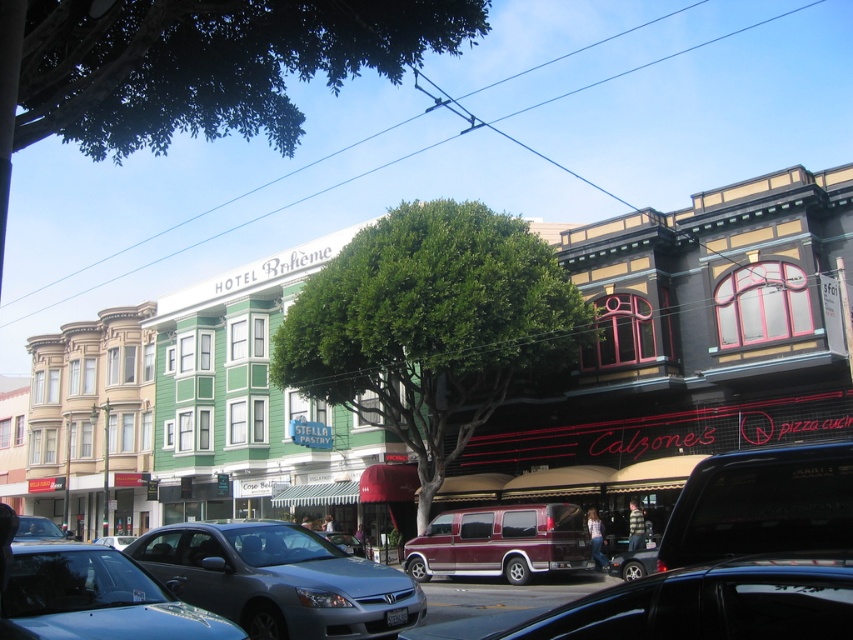
Between point (486, 636) and point (558, 560), which one is positioned in front?

Point (486, 636)

Can you confirm if shiny black sedan at center is shorter than maroon metallic van at center?

No.

Find the location of a particular element. The width and height of the screenshot is (853, 640). shiny black sedan at center is located at coordinates (688, 605).

Image resolution: width=853 pixels, height=640 pixels. Identify the location of shiny black sedan at center. (688, 605).

Is maroon metallic van at center shorter than metallic silver sedan at lower left?

Correct, maroon metallic van at center is not as tall as metallic silver sedan at lower left.

Does point (538, 534) come farther from viewer compared to point (57, 538)?

That is True.

Where is `maroon metallic van at center`? maroon metallic van at center is located at coordinates (500, 541).

Does green leafy tree at center appear on the right side of shiny black sedan at center?

No, green leafy tree at center is not to the right of shiny black sedan at center.

At what (x,y) coordinates should I click in order to perform the action: click on green leafy tree at center. Please return your answer as a coordinate pair (x, y). Looking at the image, I should click on (430, 326).

Find the location of a particular element. green leafy tree at center is located at coordinates pyautogui.click(x=430, y=326).